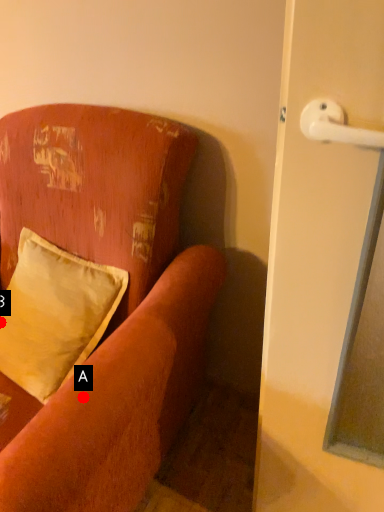
Question: Two points are circled on the image, labeled by A and B beside each circle. Which point is further to the camera?

Choices:
 (A) A is further
 (B) B is further

Answer: (B)